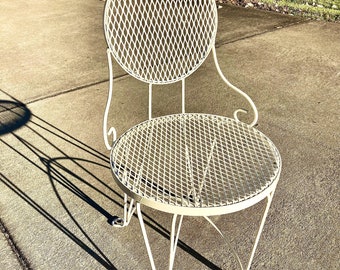
At what (x,y) coordinates should I click in order to perform the action: click on brownish rust or dirt on the side of the chair. Please return your answer as a coordinate pair (x, y). The height and width of the screenshot is (270, 340). Looking at the image, I should click on (146, 202).